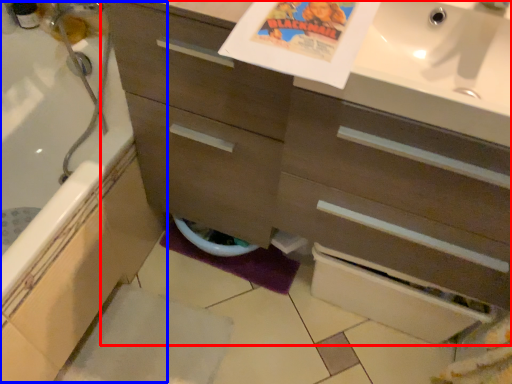
Question: Which object appears farthest to the camera in this image, bathroom cabinet (highlighted by a red box) or bath (highlighted by a blue box)?

Choices:
 (A) bathroom cabinet
 (B) bath

Answer: (B)